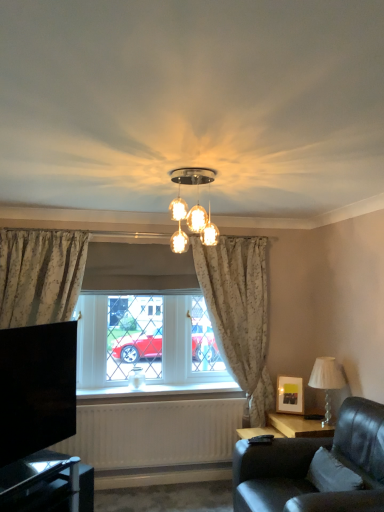
Question: Is point (331, 467) closer or farther from the camera than point (8, 487)?

Choices:
 (A) closer
 (B) farther

Answer: (B)

Question: Based on their sizes in the image, would you say white fabric pillow at lower right is bigger or smaller than black glass table at lower left?

Choices:
 (A) small
 (B) big

Answer: (A)

Question: Based on their relative distances, which object is farther from the white textured curtains at left?

Choices:
 (A) white fabric pillow at lower right
 (B) white textured lampshade at right, positioned as the 1th lamp in right-to-left order
 (C) white floral fabric curtain at center
 (D) leather couch at lower right
 (E) black glossy tv at lower left

Answer: (A)

Question: Based on their relative distances, which object is farther from the leather couch at lower right?

Choices:
 (A) white floral fabric curtain at center
 (B) black glossy tv at lower left
 (C) white textured curtains at left
 (D) black glass table at lower left
 (E) white textured lampshade at right, which is the 2th lamp in left-to-right order

Answer: (B)